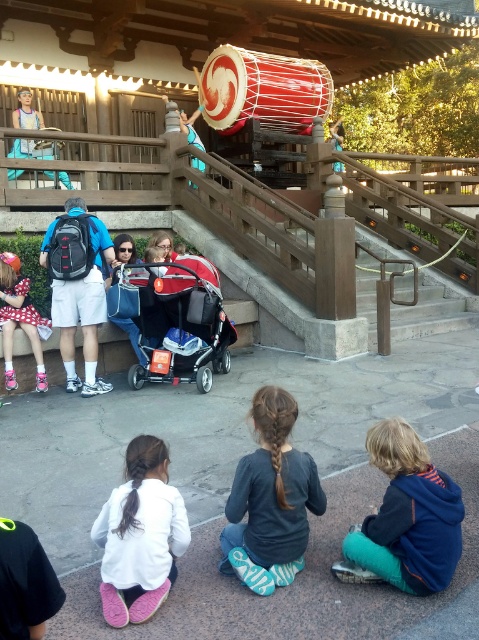
You are a photographer trying to capture a photo of the stage performance. You notice the matte pink dress at lower left and the matte blue pants at upper left are blocking your view. Which object is closer to the stage so that you can ask someone to move it first?

The matte blue pants at upper left is positioned on the left side of the matte pink dress at lower left. Since the children are facing the stage, the matte blue pants at upper left is closer to the stage and should be moved first to unblock the view.

You are a photographer trying to capture a photo of the red leather drum at upper center without the red matte baby carriage at center blocking the view. Can you move the baby carriage to the side to get a clear shot?

The red matte baby carriage at center is thinner than the red leather drum at upper center, so moving it to the side might still block the drum due to its width. Consider moving it further away or adjusting the angle for a clearer shot.